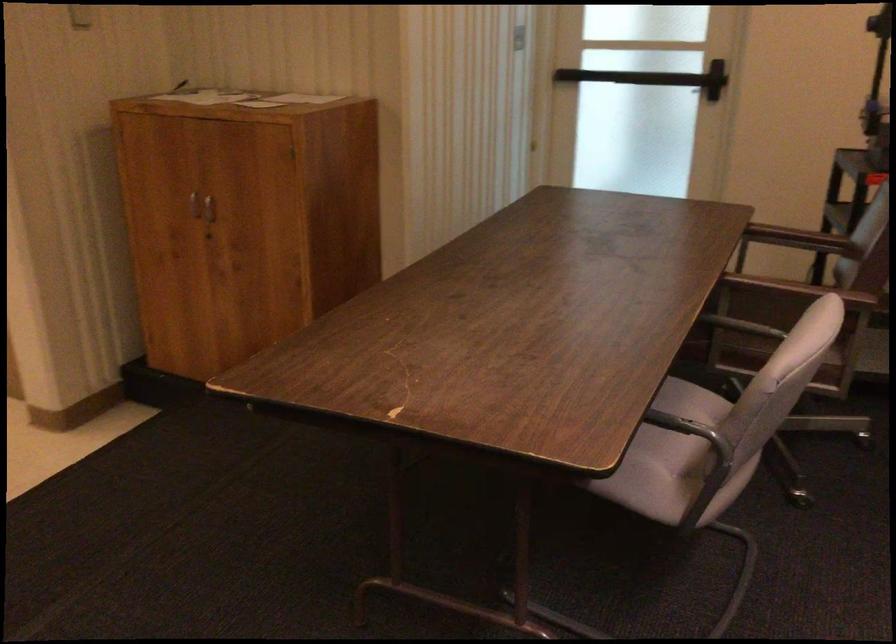
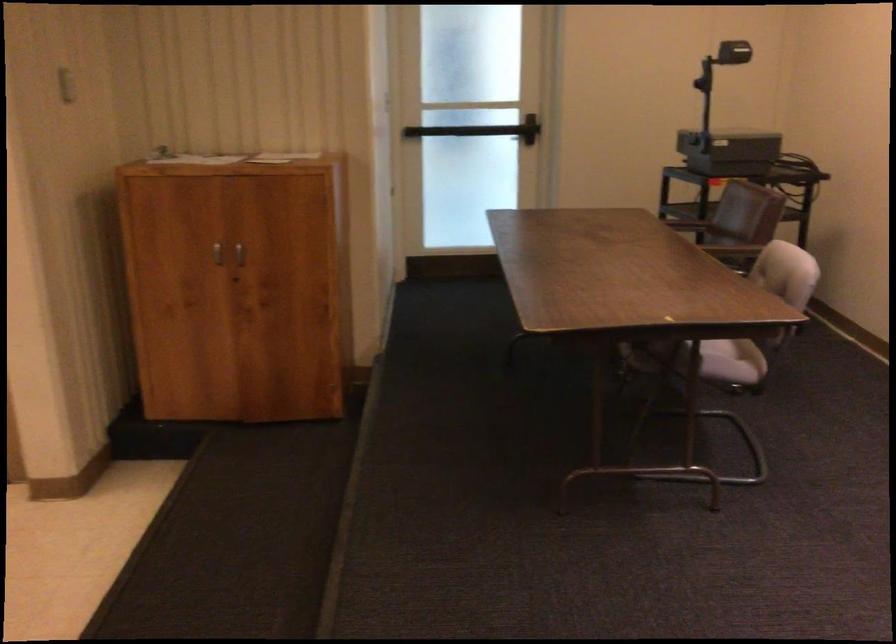
Where in the second image is the point corresponding to point (207, 213) from the first image?

(238, 258)